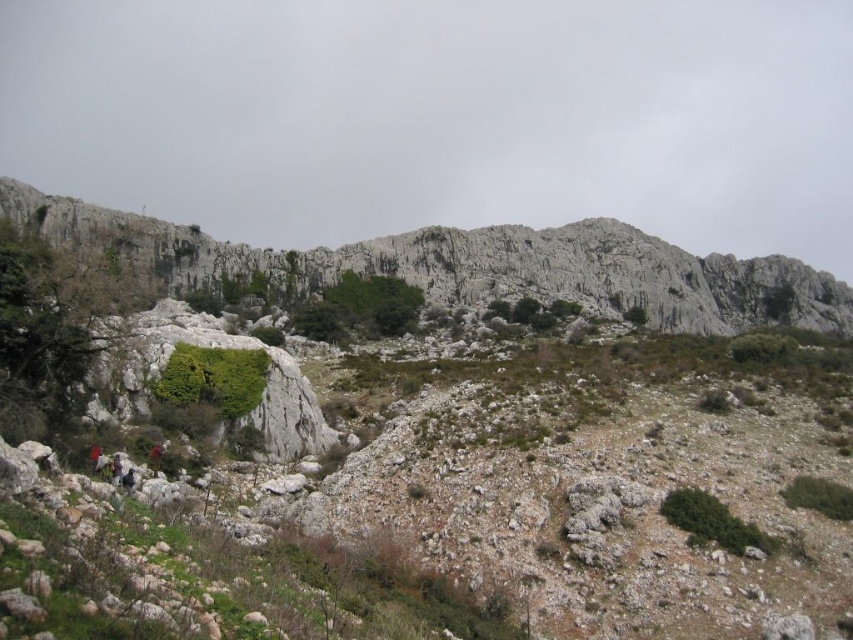
Question: Is rugged stone mountain at upper center positioned before red fabric person at lower left?

Choices:
 (A) yes
 (B) no

Answer: (B)

Question: Which point appears farthest from the camera in this image?

Choices:
 (A) (x=26, y=214)
 (B) (x=115, y=454)

Answer: (A)

Question: Among these objects, which one is farthest from the camera?

Choices:
 (A) red fabric person at lower left
 (B) rugged stone mountain at upper center

Answer: (B)

Question: Is rugged stone mountain at upper center below red fabric person at lower left?

Choices:
 (A) no
 (B) yes

Answer: (A)

Question: Does rugged stone mountain at upper center come behind red fabric person at lower left?

Choices:
 (A) no
 (B) yes

Answer: (B)